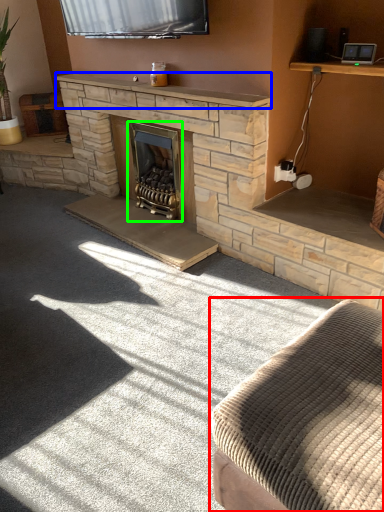
Question: Which object is positioned farthest from studio couch (highlighted by a red box)? Select from mantle (highlighted by a blue box) and wood burning stove (highlighted by a green box).

Choices:
 (A) mantle
 (B) wood burning stove

Answer: (B)